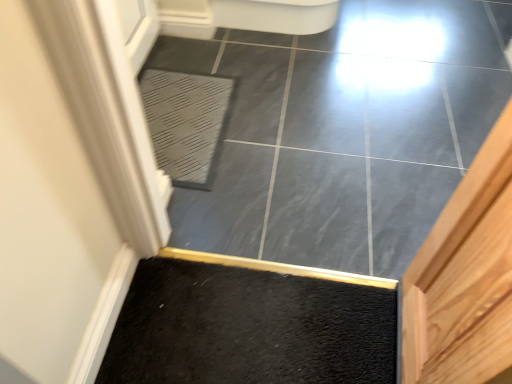
At what (x,y) coordinates should I click in order to perform the action: click on free area behind gray textured bath mat at center. Please return your answer as a coordinate pair (x, y). Looking at the image, I should click on (211, 57).